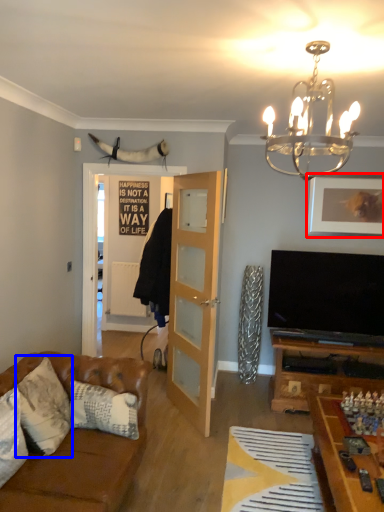
Question: Among these objects, which one is nearest to the camera, picture frame (highlighted by a red box) or pillow (highlighted by a blue box)?

Choices:
 (A) picture frame
 (B) pillow

Answer: (B)